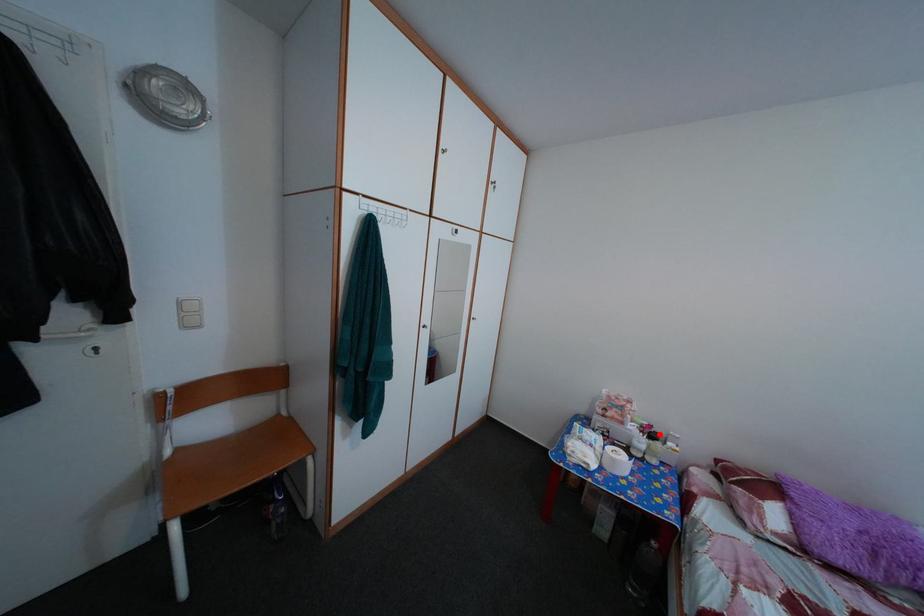
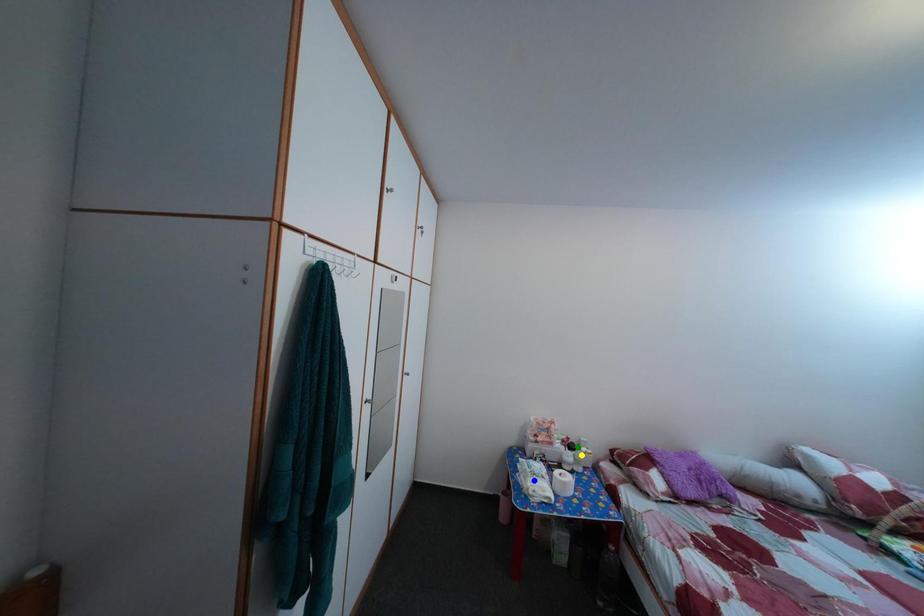
Question: I am providing you with two images of the same scene from different viewpoints. A red point is marked on the first image. You are given multiple points on the second image. In image 2, which mark is for the same physical point as the one in image 1?

Choices:
 (A) yellow point
 (B) green point
 (C) blue point

Answer: (B)